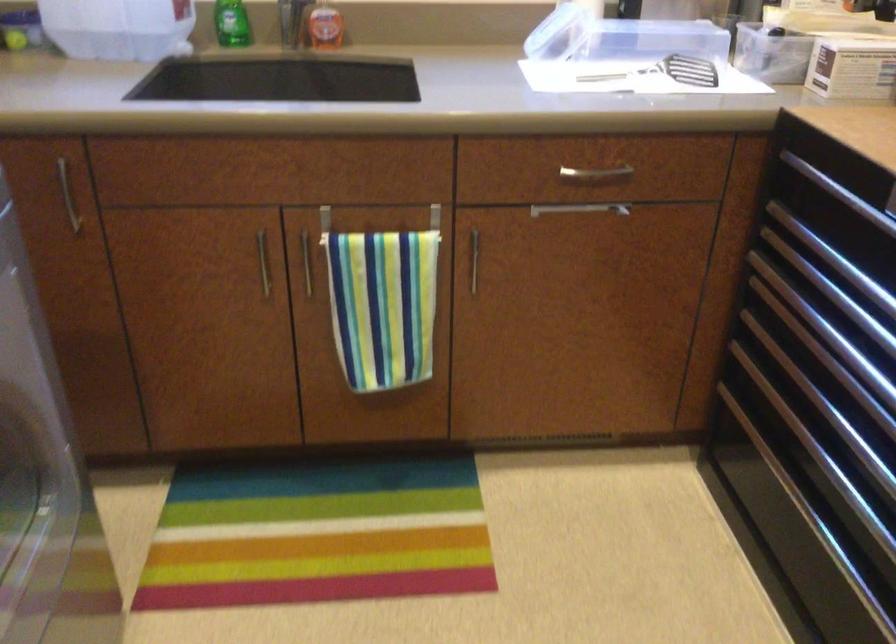
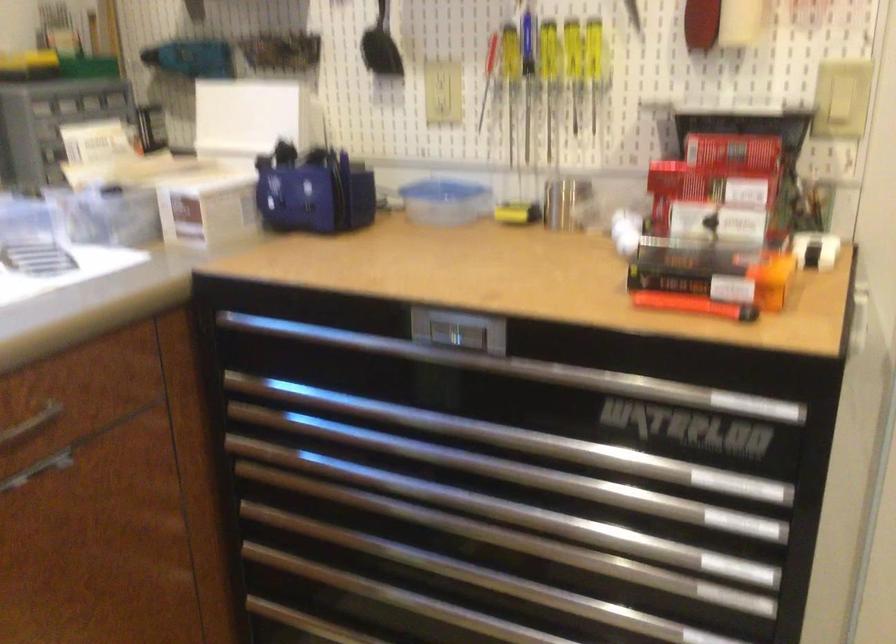
Question: How did the camera likely rotate?

Choices:
 (A) Left
 (B) Right
 (C) Up
 (D) Down

Answer: (B)